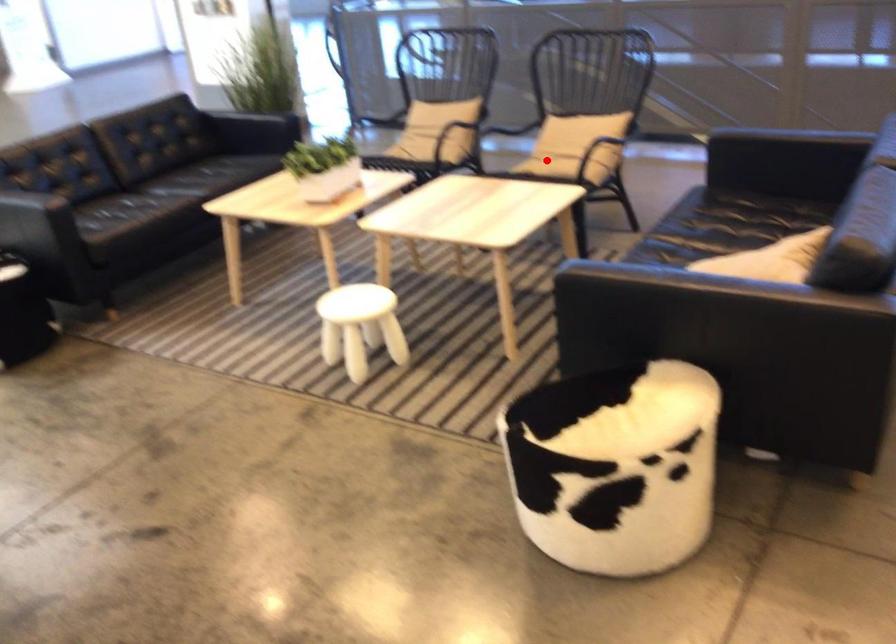
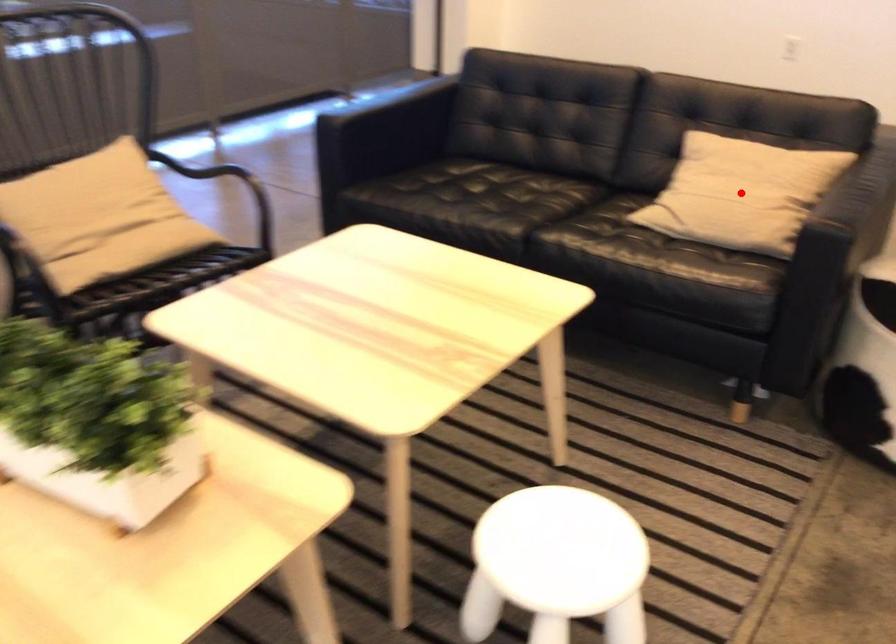
I am providing you with two images of the same scene from different viewpoints. A red point is marked on the first image and another point is marked on the second image. Are the points marked in image1 and image2 representing the same 3D position?

No